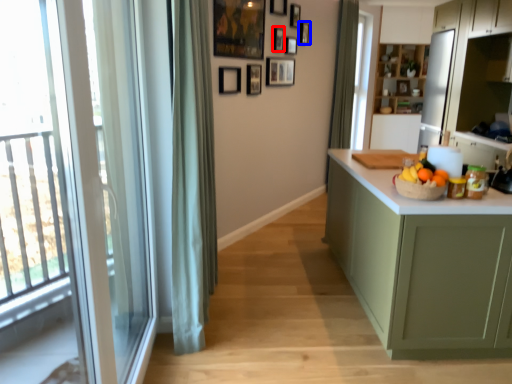
Question: Which object appears farthest to the camera in this image, picture frame (highlighted by a red box) or picture frame (highlighted by a blue box)?

Choices:
 (A) picture frame
 (B) picture frame

Answer: (B)